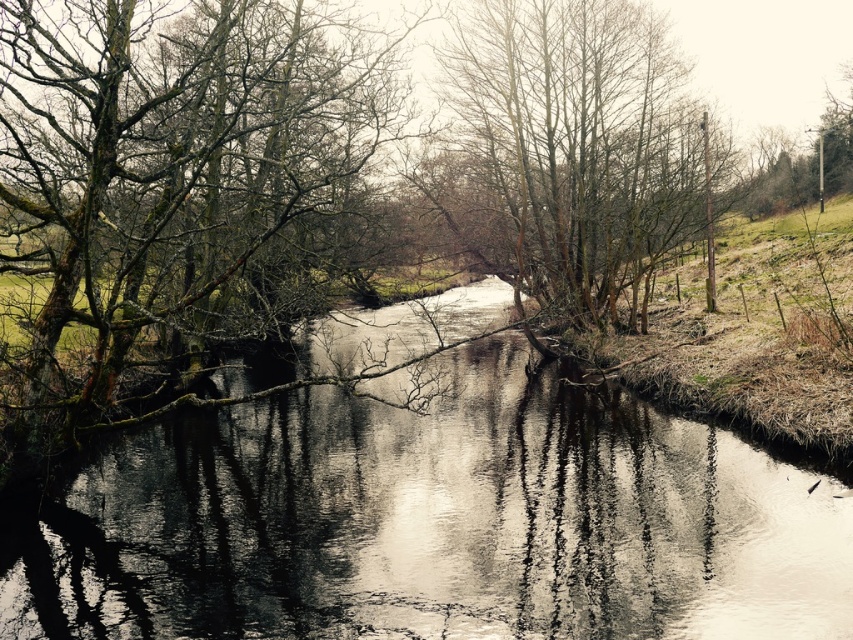
Who is shorter, reflective water at center or green mossy branches at left?

reflective water at center

The height and width of the screenshot is (640, 853). What do you see at coordinates (434, 524) in the screenshot?
I see `reflective water at center` at bounding box center [434, 524].

Where is `reflective water at center`? reflective water at center is located at coordinates tap(434, 524).

Does green mossy branches at left appear on the right side of bare branches at center?

No, green mossy branches at left is not to the right of bare branches at center.

Is green mossy branches at left wider than bare branches at center?

In fact, green mossy branches at left might be narrower than bare branches at center.

Image resolution: width=853 pixels, height=640 pixels. What do you see at coordinates (177, 193) in the screenshot?
I see `green mossy branches at left` at bounding box center [177, 193].

You are a GUI agent. You are given a task and a screenshot of the screen. Output one action in this format:
    pyautogui.click(x=<x>, y=<y>)
    Task: Click on the green mossy branches at left
    This screenshot has height=640, width=853.
    Given the screenshot: What is the action you would take?
    pyautogui.click(x=177, y=193)

Does point (654, 442) come closer to viewer compared to point (641, 58)?

That is True.

Is reflective water at center smaller than bare branches at center?

No, reflective water at center is not smaller than bare branches at center.

Between point (38, 561) and point (613, 161), which one is positioned in front?

Point (38, 561) is more forward.

Locate an element on the screen. The height and width of the screenshot is (640, 853). reflective water at center is located at coordinates (434, 524).